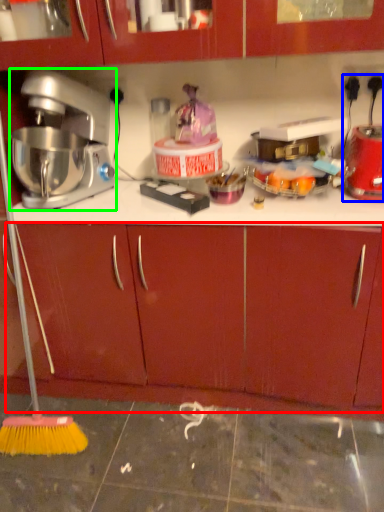
Question: Which object is positioned farthest from drawer (highlighted by a red box)? Select from blender (highlighted by a blue box) and mixer (highlighted by a green box).

Choices:
 (A) blender
 (B) mixer

Answer: (A)